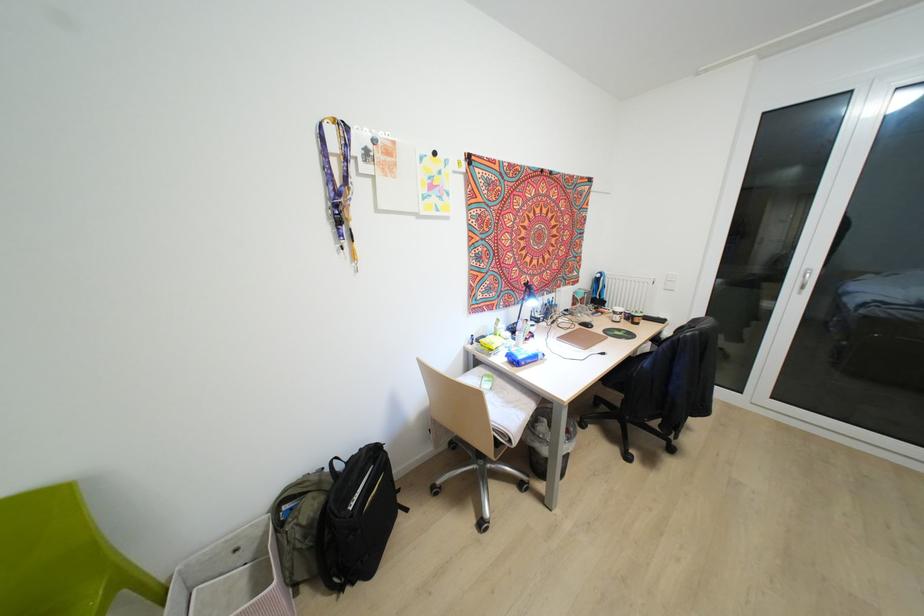
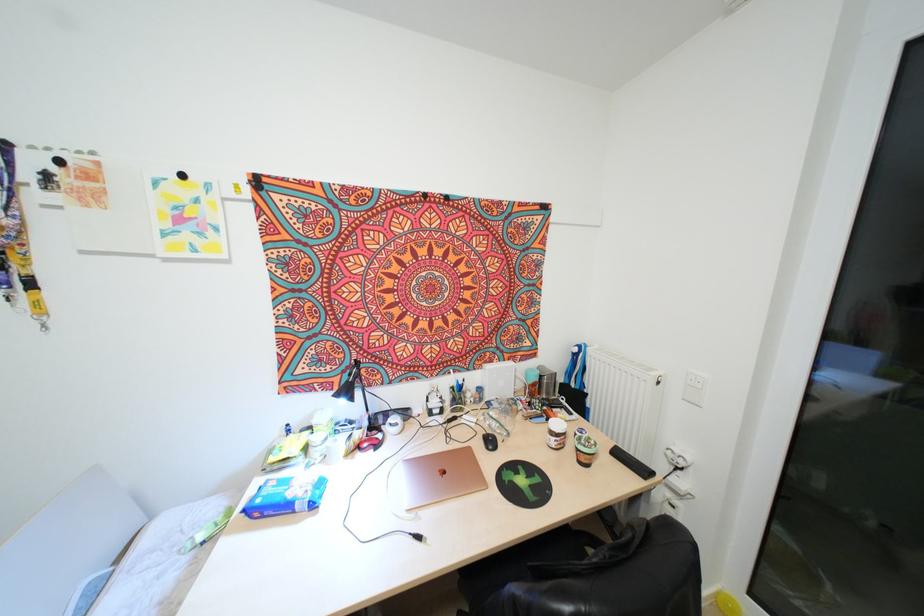
Which direction would the cameraman need to move to produce the second image?

The movement direction of the cameraman is right, forward.